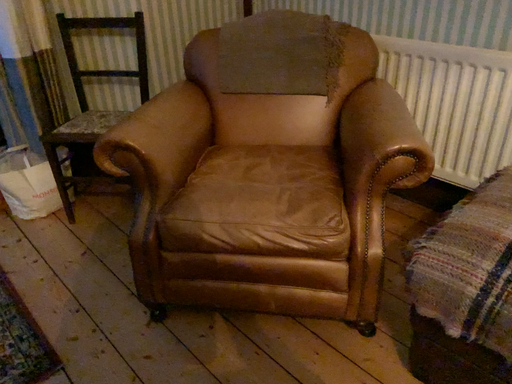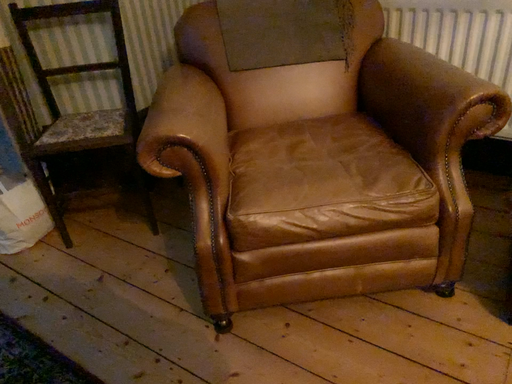
Question: How did the camera likely rotate when shooting the video?

Choices:
 (A) rotated left
 (B) rotated right

Answer: (B)